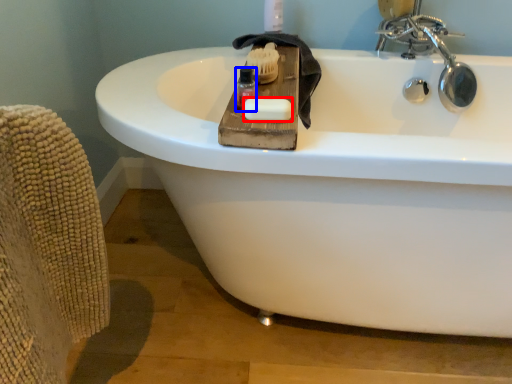
Question: Which of the following is the closest to the observer, soap (highlighted by a red box) or mouthwash (highlighted by a blue box)?

Choices:
 (A) soap
 (B) mouthwash

Answer: (A)